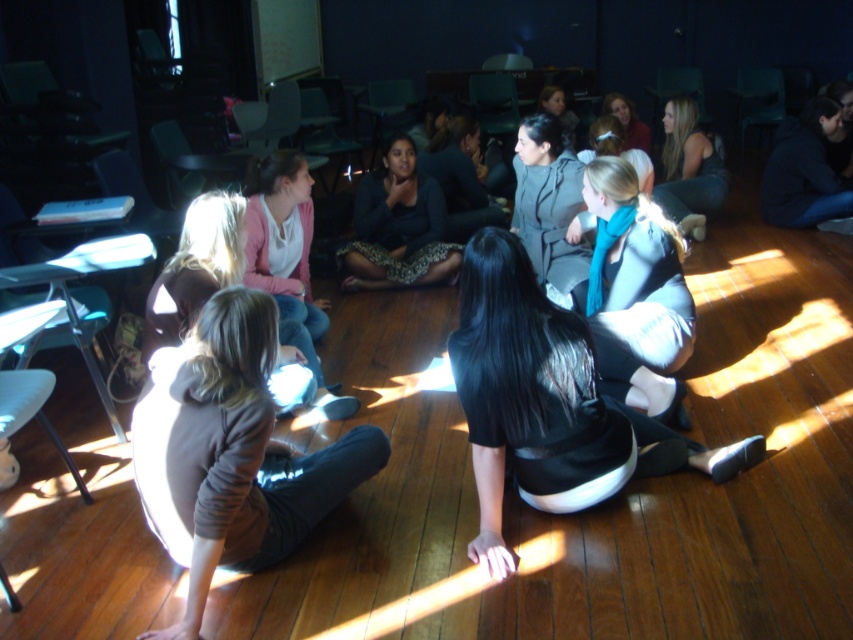
You are standing in the classroom and see two points marked on the floor. The first point is at coordinate point (640, 202) and the second is at coordinate point (683, 228). Which point is closer to you?

Point (640, 202) is closer to the viewer than point (683, 228).

You are organizing a photo shoot in this classroom scene. You need to place a small prop between the blue scarf at center and the dark brown hair at center. Which object should the prop be closer to to ensure it fits within the available space?

The blue scarf at center occupies less space than dark brown hair at center, so the prop should be placed closer to the blue scarf at center to accommodate the space constraints.